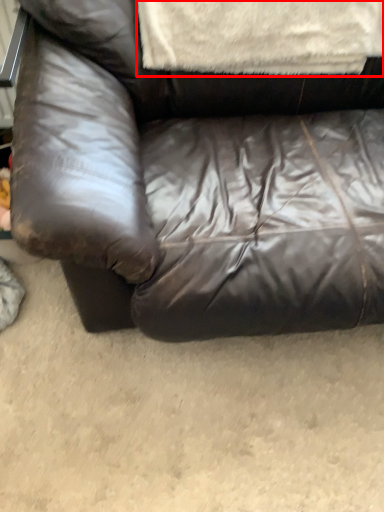
Question: From the image's perspective, what is the correct spatial relationship of blanket (annotated by the red box) in relation to studio couch?

Choices:
 (A) above
 (B) below

Answer: (A)